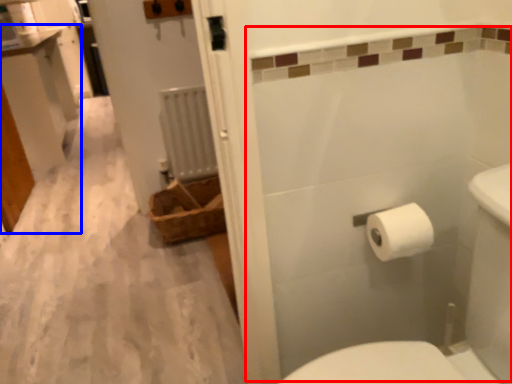
Question: Which point is further to the camera, bath (highlighted by a red box) or vanity (highlighted by a blue box)?

Choices:
 (A) bath
 (B) vanity

Answer: (B)